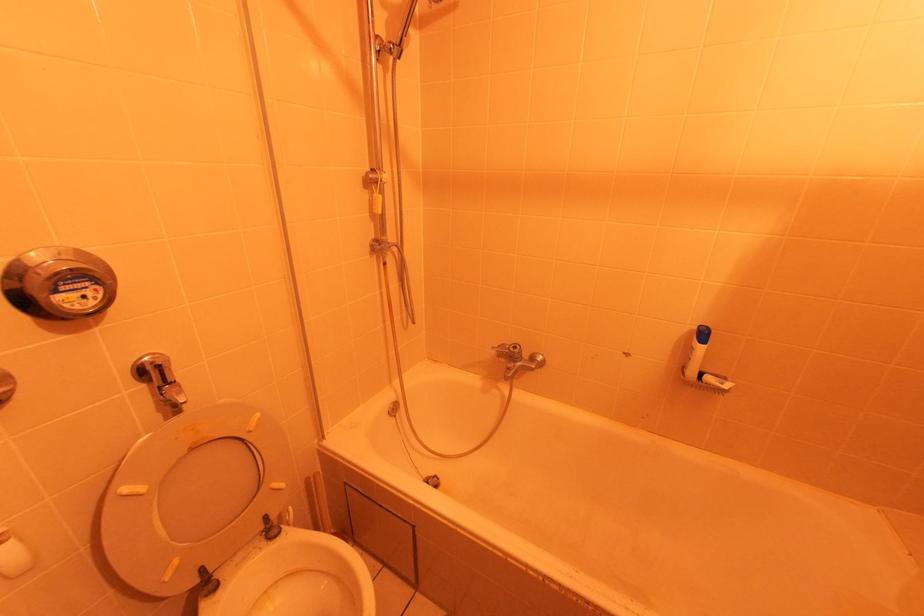
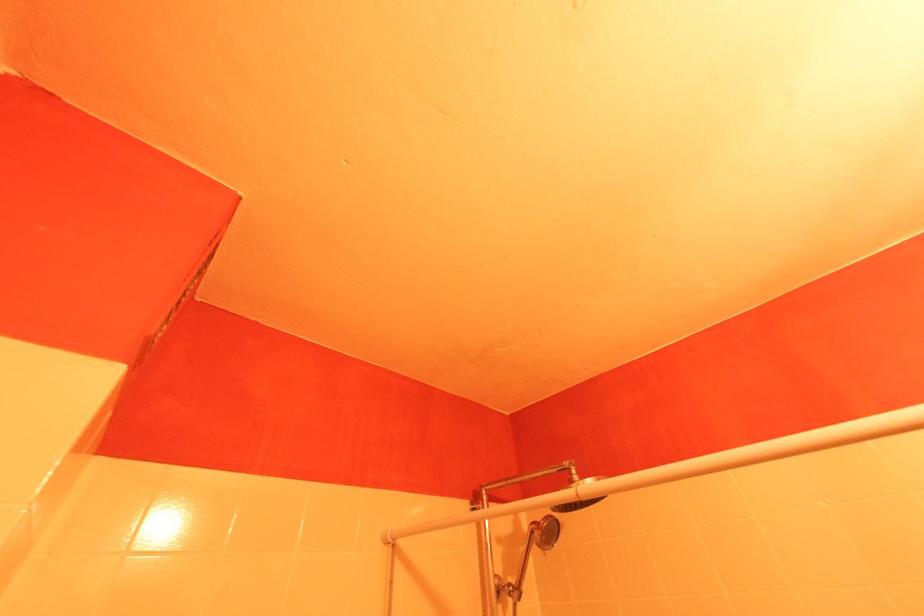
The first image is from the beginning of the video and the second image is from the end. How did the camera likely rotate when shooting the video?

The rotation direction of the camera is left-up.